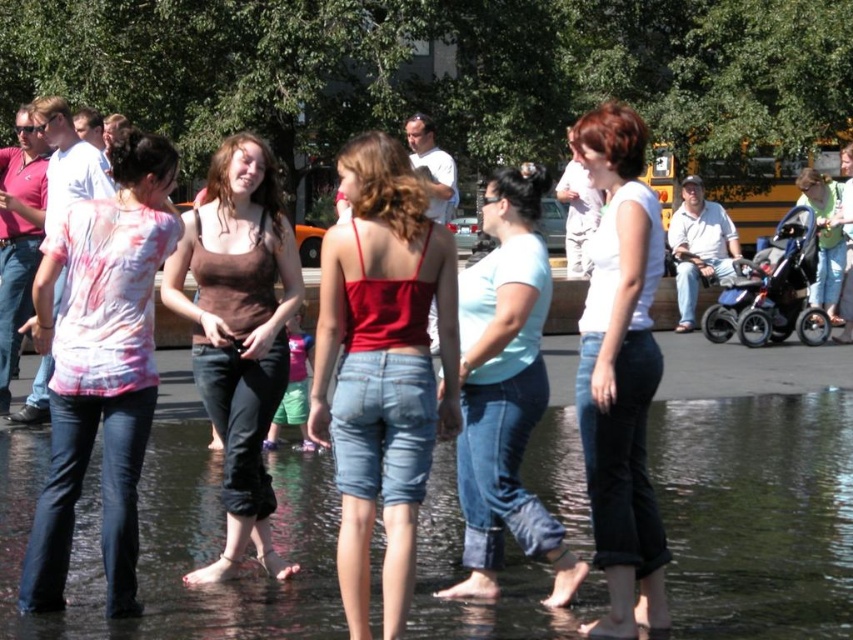
You are standing at the center of the image and want to locate the matte red tank top at center. Which direction should you look to find it?

You should look directly ahead because the matte red tank top at center is located at the center of the image.

You are organizing a clothing display and need to arrange the matte red tank top at center and the brown cotton tank top at center on a shelf. Which tank top should you place first if you want to use the shelf space efficiently?

The matte red tank top at center occupies less space than the brown cotton tank top at center, so you should place the matte red tank top at center first to utilize the shelf space efficiently.

You are a photographer standing at the edge of the water. You want to take a photo that includes both the clear water at center and the matte red tank top at center. Which object will appear closer to the camera in the photo?

The clear water at center will appear closer to the camera in the photo because it is further to the viewer than the matte red tank top at center.